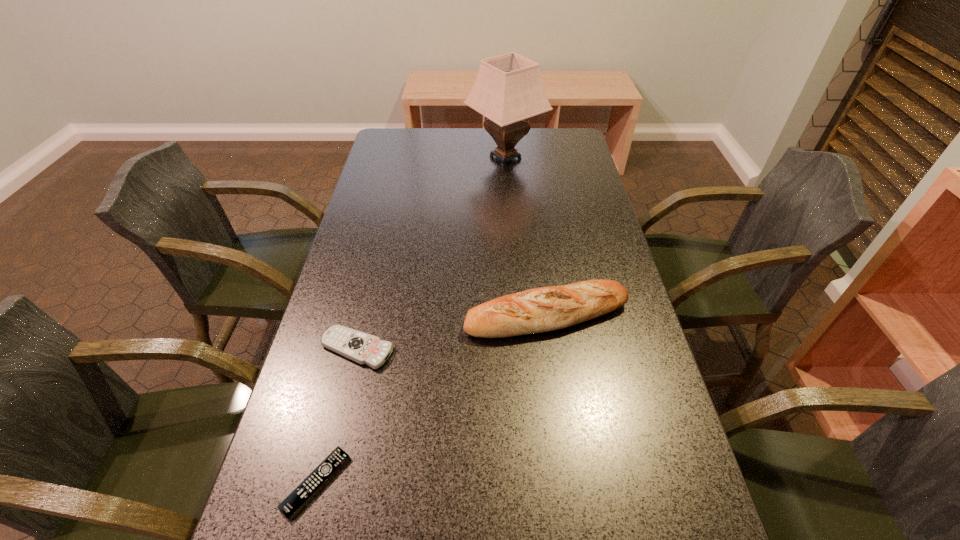
Where is `vacant region located on the back of the shorter remote control`? The height and width of the screenshot is (540, 960). vacant region located on the back of the shorter remote control is located at coordinates (347, 363).

Identify the location of object that is at the far edge. (508, 89).

The height and width of the screenshot is (540, 960). Identify the location of lampshade that is at the right edge. (508, 89).

The width and height of the screenshot is (960, 540). In order to click on baguet present at the right edge in this screenshot , I will do `click(537, 310)`.

Where is `object that is at the far right corner`? object that is at the far right corner is located at coordinates (508, 89).

Locate an element on the screen. vacant space at the far edge of the desktop is located at coordinates (430, 128).

At what (x,y) coordinates should I click in order to perform the action: click on vacant space at the left edge of the desktop. Please return your answer as a coordinate pair (x, y). The image size is (960, 540). Looking at the image, I should click on (274, 462).

You are a GUI agent. You are given a task and a screenshot of the screen. Output one action in this format:
    pyautogui.click(x=<x>, y=<y>)
    Task: Click on the blank space at the right edge of the desktop
    
    Given the screenshot: What is the action you would take?
    pyautogui.click(x=551, y=170)

Locate an element on the screen. The image size is (960, 540). vacant space at the far left corner of the desktop is located at coordinates (408, 154).

You are a GUI agent. You are given a task and a screenshot of the screen. Output one action in this format:
    pyautogui.click(x=<x>, y=<y>)
    Task: Click on the vacant space at the far right corner of the desktop
    This screenshot has width=960, height=540.
    Given the screenshot: What is the action you would take?
    pyautogui.click(x=576, y=156)